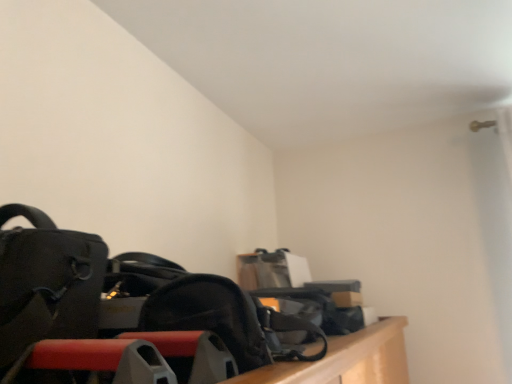
Question: Is matte black bag at left situated inside black matte shoulder bag at center or outside?

Choices:
 (A) outside
 (B) inside

Answer: (A)

Question: From the image's perspective, is matte black bag at left above or below black matte shoulder bag at center?

Choices:
 (A) above
 (B) below

Answer: (A)

Question: Considering their positions, is matte black bag at left located in front of or behind black matte shoulder bag at center?

Choices:
 (A) behind
 (B) front

Answer: (B)

Question: From their relative heights in the image, would you say black matte shoulder bag at center is taller or shorter than matte black bag at left?

Choices:
 (A) tall
 (B) short

Answer: (B)

Question: Is black matte shoulder bag at center situated inside matte black bag at left or outside?

Choices:
 (A) outside
 (B) inside

Answer: (A)

Question: Would you say black matte shoulder bag at center is to the left or to the right of matte black bag at left in the picture?

Choices:
 (A) left
 (B) right

Answer: (B)

Question: Considering the positions of black matte shoulder bag at center and matte black bag at left in the image, is black matte shoulder bag at center wider or thinner than matte black bag at left?

Choices:
 (A) thin
 (B) wide

Answer: (A)